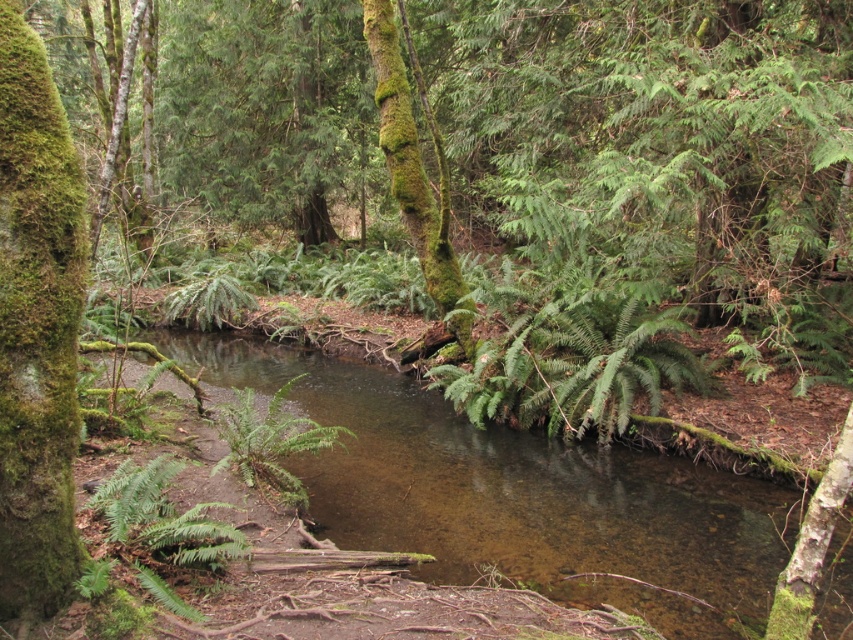
Question: Does green mossy tree trunk at center appear over green leafy fern at center?

Choices:
 (A) no
 (B) yes

Answer: (B)

Question: Which object is the closest to the clear water stream at center?

Choices:
 (A) green mossy tree trunk at center
 (B) green leafy fern at center

Answer: (B)

Question: Is clear water stream at center smaller than green mossy tree trunk at left?

Choices:
 (A) yes
 (B) no

Answer: (B)

Question: Based on their relative distances, which object is nearer to the clear water stream at center?

Choices:
 (A) green mossy tree trunk at left
 (B) green mossy tree trunk at center
 (C) green leafy fern at center

Answer: (C)

Question: Does green mossy tree trunk at center appear on the right side of green leafy fern at center?

Choices:
 (A) no
 (B) yes

Answer: (B)

Question: Which point is closer to the camera?

Choices:
 (A) (589, 579)
 (B) (451, 275)
 (C) (233, 432)

Answer: (A)